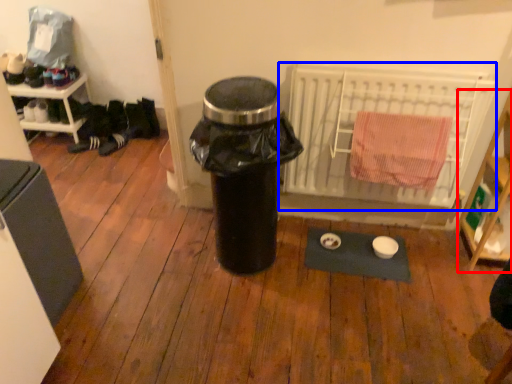
Question: Which of the following is the closest to the observer, shelf (highlighted by a red box) or radiator (highlighted by a blue box)?

Choices:
 (A) shelf
 (B) radiator

Answer: (A)